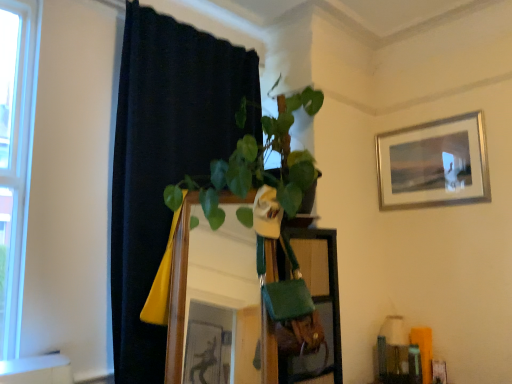
Question: Can you confirm if silver metallic picture frame at upper right is positioned to the left of green fabric bag at center?

Choices:
 (A) no
 (B) yes

Answer: (A)

Question: Is silver metallic picture frame at upper right behind green fabric bag at center?

Choices:
 (A) no
 (B) yes

Answer: (B)

Question: From the image's perspective, is silver metallic picture frame at upper right beneath green fabric bag at center?

Choices:
 (A) no
 (B) yes

Answer: (A)

Question: From the image's perspective, is silver metallic picture frame at upper right over green fabric bag at center?

Choices:
 (A) no
 (B) yes

Answer: (B)

Question: From a real-world perspective, is silver metallic picture frame at upper right on green fabric bag at center?

Choices:
 (A) yes
 (B) no

Answer: (A)

Question: Considering the positions of silver metallic picture frame at upper right and wooden mirror at center in the image, is silver metallic picture frame at upper right taller or shorter than wooden mirror at center?

Choices:
 (A) short
 (B) tall

Answer: (A)

Question: Do you think silver metallic picture frame at upper right is within wooden mirror at center, or outside of it?

Choices:
 (A) outside
 (B) inside

Answer: (A)

Question: Is point (435, 127) closer or farther from the camera than point (229, 246)?

Choices:
 (A) closer
 (B) farther

Answer: (B)

Question: Based on their sizes in the image, would you say silver metallic picture frame at upper right is bigger or smaller than wooden mirror at center?

Choices:
 (A) big
 (B) small

Answer: (B)

Question: Is wooden mirror at center bigger or smaller than silver metallic picture frame at upper right?

Choices:
 (A) big
 (B) small

Answer: (A)

Question: Considering the relative positions of wooden mirror at center and silver metallic picture frame at upper right in the image provided, is wooden mirror at center to the left or to the right of silver metallic picture frame at upper right?

Choices:
 (A) right
 (B) left

Answer: (B)

Question: From a real-world perspective, is wooden mirror at center above or below silver metallic picture frame at upper right?

Choices:
 (A) above
 (B) below

Answer: (B)

Question: From the image's perspective, is wooden mirror at center positioned above or below silver metallic picture frame at upper right?

Choices:
 (A) above
 (B) below

Answer: (B)

Question: Is green fabric bag at center situated inside wooden mirror at center or outside?

Choices:
 (A) outside
 (B) inside

Answer: (A)

Question: In terms of width, does green fabric bag at center look wider or thinner when compared to wooden mirror at center?

Choices:
 (A) thin
 (B) wide

Answer: (B)